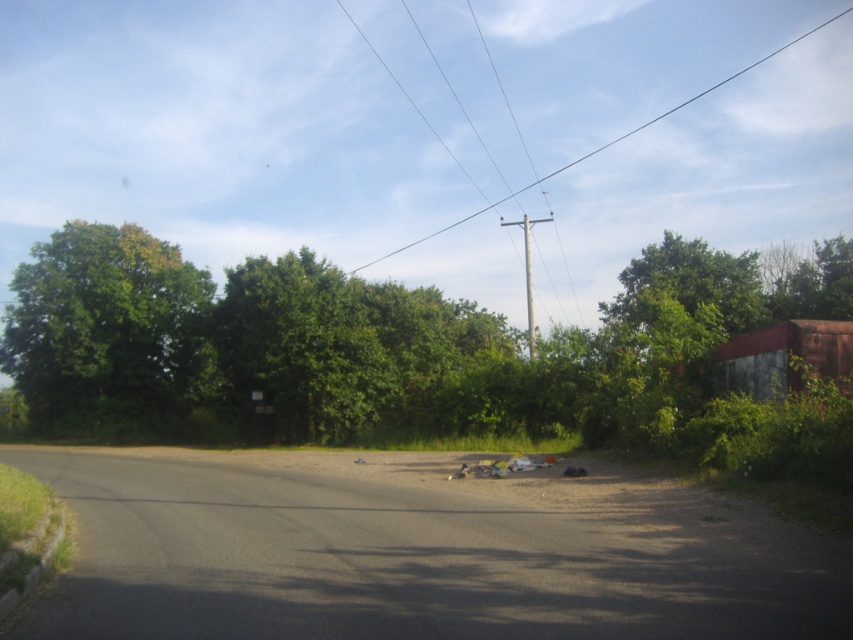
Looking at this image, you are a pedestrian standing on the road and want to cross to the other side. There is a green leafy tree at left and a smooth wire at upper center. Which object is closer to your current position?

The green leafy tree at left is closer to your current position because it is positioned on the left side of the smooth wire at upper center, meaning it is nearer to the road where you are standing.

You are a delivery driver approaching the curved road. You notice two wires above you at the upper center of the road. The wires are labeled as the smooth wire at upper center and the metallic wire at upper center. Which wire is wider?

The smooth wire at upper center is wider than the metallic wire at upper center according to the description provided.

You are a delivery driver approaching the road shown in the image. You notice two wires at the upper center of the road ahead. One is labeled as smooth wire at upper center and the other as metallic wire at upper center. Which wire should you avoid hitting first as you drive straight ahead?

The metallic wire at upper center should be avoided first because the smooth wire at upper center is positioned to its right, meaning the metallic wire is closer to your path as you drive straight ahead.